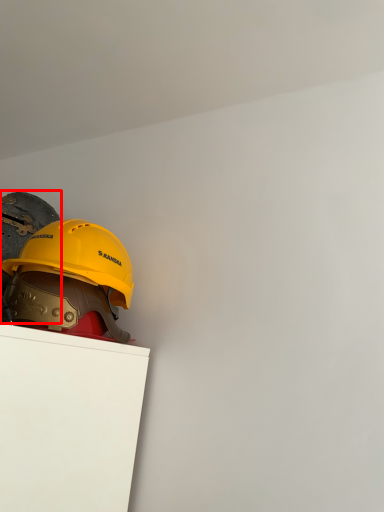
Question: From the image, what is the correct spatial relationship of helmet (annotated by the red box) in relation to helmet?

Choices:
 (A) right
 (B) left

Answer: (B)